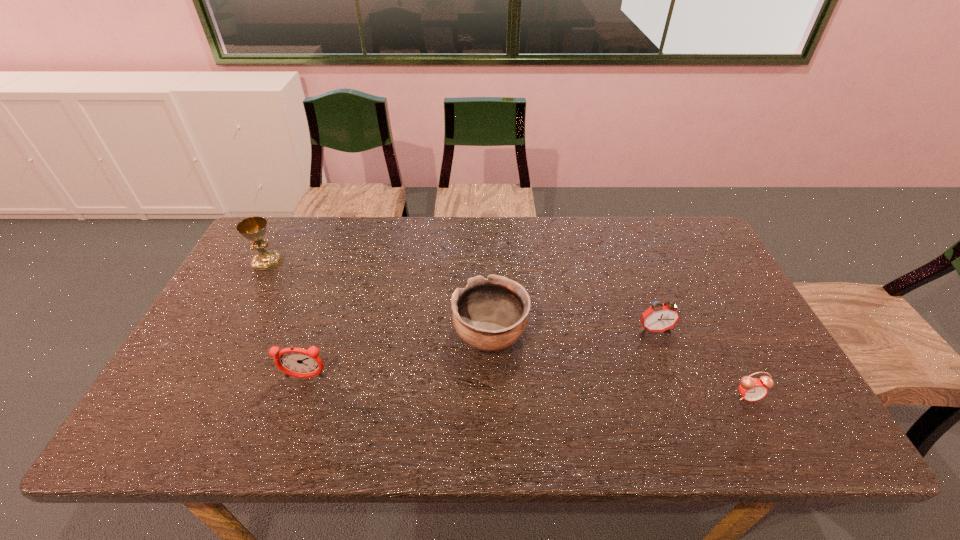
Image resolution: width=960 pixels, height=540 pixels. I want to click on free region at the far right corner of the desktop, so click(x=709, y=254).

This screenshot has height=540, width=960. I want to click on vacant region at the near right corner, so click(x=748, y=411).

Locate an element on the screen. The image size is (960, 540). empty space that is in between the rightmost alarm clock and the farthest alarm clock is located at coordinates (701, 363).

Identify the location of empty location between the shortest alarm clock and the second alarm clock from left to right. (701, 363).

In order to click on vacant area that lies between the fourth object from left to right and the shortest alarm clock in this screenshot , I will do `click(701, 363)`.

Locate an element on the screen. This screenshot has height=540, width=960. free space between the farthest object and the third object from left to right is located at coordinates (378, 298).

Where is `vacant space in between the leftmost alarm clock and the farthest alarm clock`? vacant space in between the leftmost alarm clock and the farthest alarm clock is located at coordinates (480, 353).

Image resolution: width=960 pixels, height=540 pixels. What are the coordinates of `unoccupied area between the third object from left to right and the second nearest alarm clock` in the screenshot? It's located at click(397, 356).

Find the location of `object that is the fourth closest one to the third object from right to left`. object that is the fourth closest one to the third object from right to left is located at coordinates (254, 228).

Identify the location of object that is the third nearest to the second alarm clock from right to left. (297, 362).